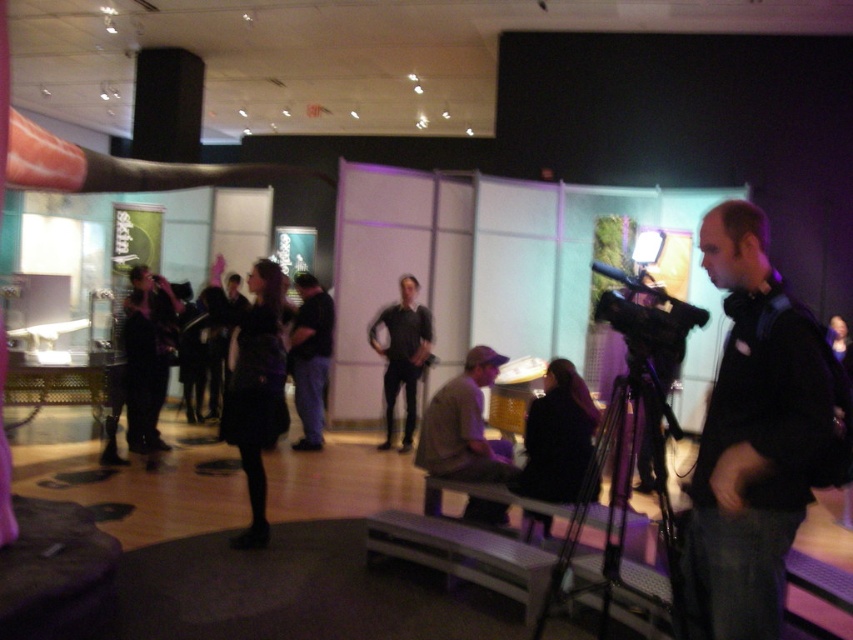
Question: Is matte black dress at center thinner than black matte shirt at center?

Choices:
 (A) no
 (B) yes

Answer: (B)

Question: Which point is closer to the camera?

Choices:
 (A) coord(662,538)
 (B) coord(167,356)
 (C) coord(260,493)

Answer: (A)

Question: Considering the real-world distances, which object is closest to the black matte tripod at lower center?

Choices:
 (A) black matte jacket at right
 (B) black fabric dress at center
 (C) black matte shirt at center

Answer: (A)

Question: Among these points, which one is nearest to the camera?

Choices:
 (A) (416, 285)
 (B) (727, 500)
 (C) (316, 440)
 (D) (643, 371)

Answer: (B)

Question: Observing the image, what is the correct spatial positioning of black matte jacket at right in reference to brown suede jacket at center?

Choices:
 (A) above
 (B) below

Answer: (A)

Question: Is black matte jacket at right thinner than black fabric dress at center?

Choices:
 (A) no
 (B) yes

Answer: (B)